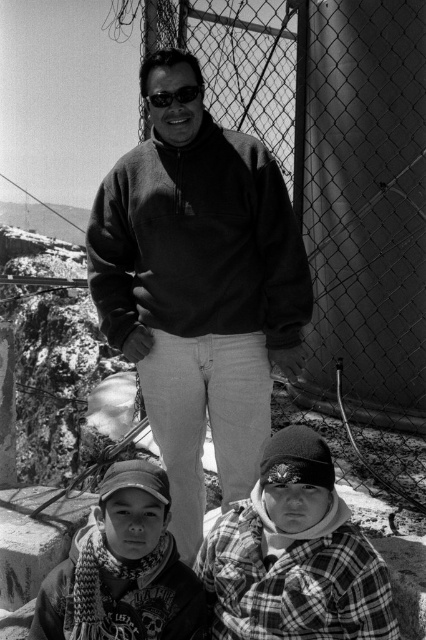
You are a fashion designer analyzing this image. You notice two plaid shirts in the scene. Which one is taller, the plaid flannel shirt at lower right or the plaid fabric shirt at lower center?

The plaid flannel shirt at lower right has a greater height compared to the plaid fabric shirt at lower center.

You are a photographer trying to capture a clear shot of both the plaid flannel shirt at lower right and the matte black goggles at center. Which object should you focus on first to ensure both are in focus?

You should focus on the plaid flannel shirt at lower right first because it is closer to the viewer than the matte black goggles at center, so adjusting focus from near to far will help both objects be in focus.